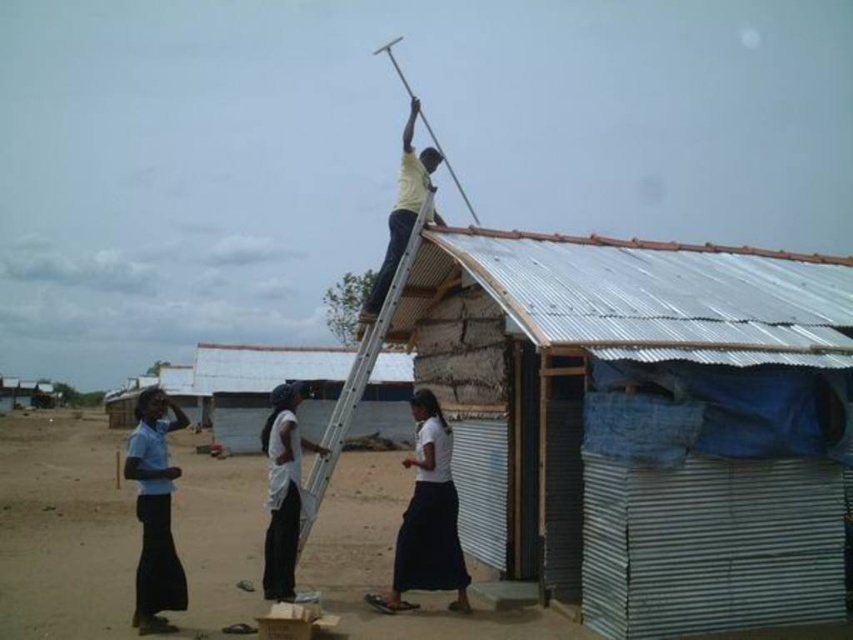
Is point (61, 540) closer to camera compared to point (141, 499)?

No, it is not.

Is dirt field at lower left taller than blue fabric skirt at lower left?

Incorrect, dirt field at lower left's height is not larger of blue fabric skirt at lower left's.

In order to click on dirt field at lower left in this screenshot , I will do `click(62, 531)`.

In order to click on dirt field at lower left in this screenshot , I will do `click(62, 531)`.

Is point (78, 589) closer to viewer compared to point (379, 346)?

Yes, it is in front of point (379, 346).

Who is positioned more to the left, dirt field at lower left or metallic silver ladder at upper center?

dirt field at lower left

You are a GUI agent. You are given a task and a screenshot of the screen. Output one action in this format:
    pyautogui.click(x=<x>, y=<y>)
    Task: Click on the dirt field at lower left
    Image resolution: width=853 pixels, height=640 pixels.
    Given the screenshot: What is the action you would take?
    pyautogui.click(x=62, y=531)

From the picture: Between dirt field at lower left and yellow matte shirt at upper center, which one is positioned higher?

yellow matte shirt at upper center is higher up.

Which is below, dirt field at lower left or yellow matte shirt at upper center?

dirt field at lower left is lower down.

Is point (22, 563) less distant than point (384, 273)?

No, (22, 563) is further to viewer.

Identify the location of dirt field at lower left. (62, 531).